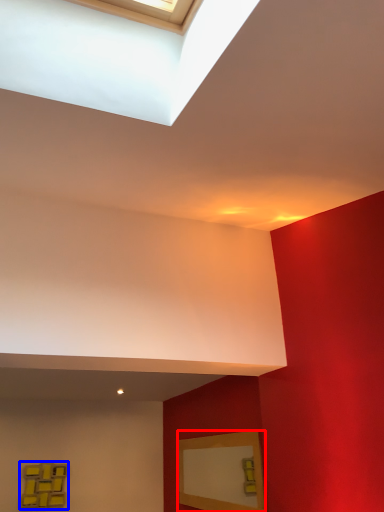
Question: Among these objects, which one is nearest to the camera, picture frame (highlighted by a red box) or picture frame (highlighted by a blue box)?

Choices:
 (A) picture frame
 (B) picture frame

Answer: (A)